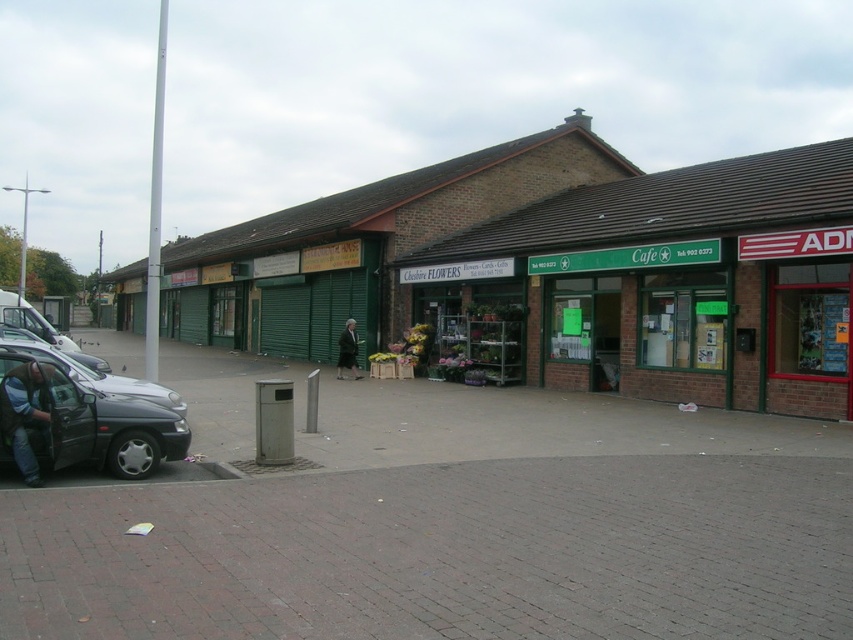
Is matte black van at lower left to the right of shiny silver car at left from the viewer's perspective?

Yes, matte black van at lower left is to the right of shiny silver car at left.

Can you confirm if matte black van at lower left is positioned to the left of shiny silver car at left?

No, matte black van at lower left is not to the left of shiny silver car at left.

Between point (45, 460) and point (129, 378), which one is positioned behind?

The point (129, 378) is behind.

I want to click on matte black van at lower left, so click(x=79, y=424).

Between denim jacket at lower left and shiny silver car at left, which one has less height?

Standing shorter between the two is shiny silver car at left.

Does denim jacket at lower left appear over shiny silver car at left?

No.

Where is `denim jacket at lower left`? The height and width of the screenshot is (640, 853). denim jacket at lower left is located at coordinates (25, 416).

Based on the photo, which of these two, matte black van at lower left or dark green coat at center, stands taller?

Standing taller between the two is dark green coat at center.

Can you confirm if matte black van at lower left is smaller than dark green coat at center?

Incorrect, matte black van at lower left is not smaller in size than dark green coat at center.

Find the location of a particular element. matte black van at lower left is located at coordinates (79, 424).